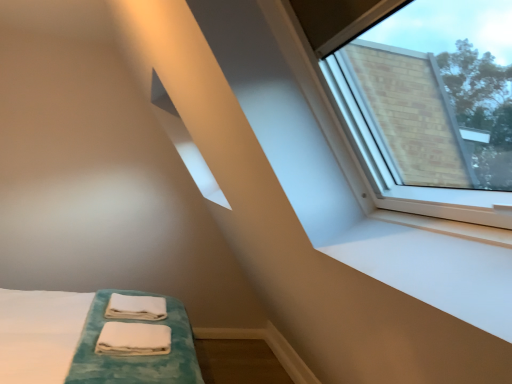
I want to click on white soft towel at lower center, so click(x=136, y=307).

The height and width of the screenshot is (384, 512). What do you see at coordinates (136, 307) in the screenshot?
I see `white soft towel at lower center` at bounding box center [136, 307].

Identify the location of white soft towel at lower center. The width and height of the screenshot is (512, 384). (133, 339).

What do you see at coordinates (133, 339) in the screenshot?
I see `white soft towel at lower center` at bounding box center [133, 339].

Where is `white soft towel at lower center`? The height and width of the screenshot is (384, 512). white soft towel at lower center is located at coordinates (136, 307).

Which is more to the right, white soft towel at lower center or white soft towel at lower center?

Positioned to the right is white soft towel at lower center.

Between white soft towel at lower center and white soft towel at lower center, which one is positioned in front?

Positioned in front is white soft towel at lower center.

Is point (106, 331) closer to camera compared to point (106, 317)?

Yes, point (106, 331) is in front of point (106, 317).

From the image's perspective, is white soft towel at lower center positioned above or below white soft towel at lower center?

From the image's perspective, white soft towel at lower center appears below white soft towel at lower center.

From a real-world perspective, between white soft towel at lower center and white soft towel at lower center, who is vertically lower?

In real-world perspective, white soft towel at lower center is lower.

Is white soft towel at lower center wider or thinner than white soft towel at lower center?

Clearly, white soft towel at lower center has less width compared to white soft towel at lower center.

Considering the relative sizes of white soft towel at lower center and white soft towel at lower center in the image provided, is white soft towel at lower center taller than white soft towel at lower center?

No.

Who is bigger, white soft towel at lower center or white soft towel at lower center?

With larger size is white soft towel at lower center.

Is white soft towel at lower center situated inside white soft towel at lower center or outside?

white soft towel at lower center lies outside white soft towel at lower center.

Is white soft towel at lower center far away from white soft towel at lower center?

No, white soft towel at lower center is not far away from white soft towel at lower center.

Is white soft towel at lower center facing away from white soft towel at lower center?

No, white soft towel at lower center is not at the back of white soft towel at lower center.

How different are the orientations of white soft towel at lower center and white soft towel at lower center in degrees?

They differ by 1.61 degrees in their facing directions.

The height and width of the screenshot is (384, 512). In the image, there is a white soft towel at lower center. Identify the location of sheet below it (from the image's perspective). coord(133,339).

Does white soft towel at lower center appear on the left side of white soft towel at lower center?

Yes, white soft towel at lower center is to the left of white soft towel at lower center.

Is white soft towel at lower center in front of or behind white soft towel at lower center in the image?

Clearly, white soft towel at lower center is behind white soft towel at lower center.

Does point (124, 306) come farther from viewer compared to point (147, 334)?

Yes, point (124, 306) is behind point (147, 334).

From the image's perspective, would you say white soft towel at lower center is positioned over white soft towel at lower center?

Yes, from the image's perspective, white soft towel at lower center is above white soft towel at lower center.

From a real-world perspective, is white soft towel at lower center located higher than white soft towel at lower center?

Yes, from a real-world perspective, white soft towel at lower center is over white soft towel at lower center

Looking at their sizes, would you say white soft towel at lower center is wider or thinner than white soft towel at lower center?

In the image, white soft towel at lower center appears to be wider than white soft towel at lower center.

Does white soft towel at lower center have a lesser height compared to white soft towel at lower center?

Incorrect, the height of white soft towel at lower center does not fall short of that of white soft towel at lower center.

Does white soft towel at lower center have a larger size compared to white soft towel at lower center?

Correct, white soft towel at lower center is larger in size than white soft towel at lower center.

Is white soft towel at lower center positioned beyond the bounds of white soft towel at lower center?

Yes, white soft towel at lower center is outside of white soft towel at lower center.

Is there a large distance between white soft towel at lower center and white soft towel at lower center?

They are positioned close to each other.

Is white soft towel at lower center facing towards white soft towel at lower center?

No, white soft towel at lower center is not facing towards white soft towel at lower center.

What are the coordinates of `sheet that is in front of the white soft towel at lower center` in the screenshot? It's located at (133, 339).

Locate an element on the screen. This screenshot has width=512, height=384. sheet below the white soft towel at lower center (from the image's perspective) is located at coordinates (133, 339).

The width and height of the screenshot is (512, 384). In order to click on sheet that appears in front of the white soft towel at lower center in this screenshot , I will do `click(133, 339)`.